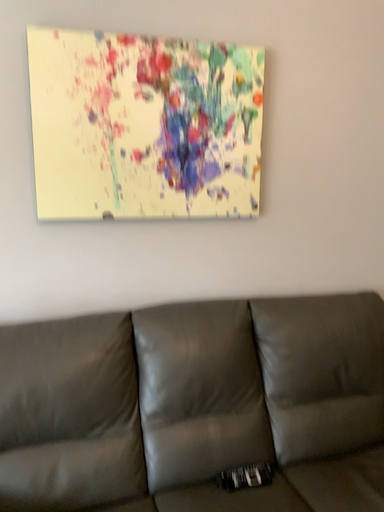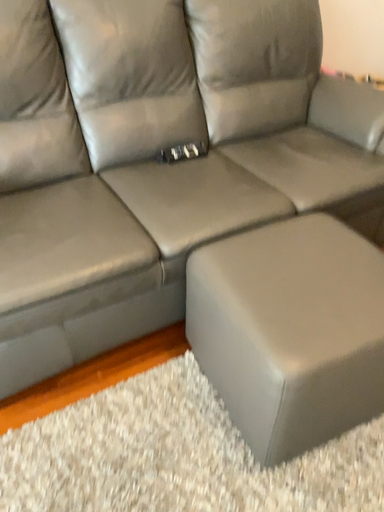
Question: Which way did the camera rotate in the video?

Choices:
 (A) rotated right
 (B) rotated left

Answer: (A)